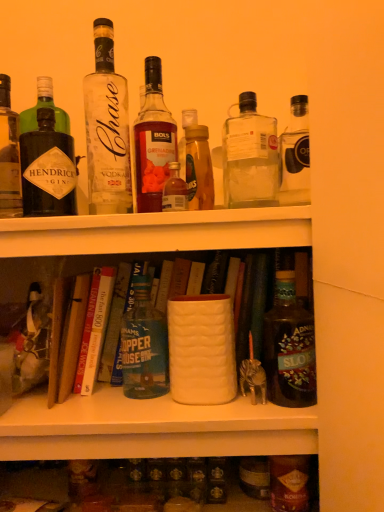
Measure the distance between point (87, 390) and camera.

31.61 inches.

The height and width of the screenshot is (512, 384). Describe the element at coordinates (94, 330) in the screenshot. I see `hardcover book at center, the 2th book positioned from the right` at that location.

This screenshot has width=384, height=512. What do you see at coordinates (199, 168) in the screenshot?
I see `translucent glass bottle at center, placed as the 5th bottle when sorted from left to right` at bounding box center [199, 168].

Locate an element on the screen. This screenshot has width=384, height=512. translucent glass bottle at center, placed as the 5th bottle when sorted from left to right is located at coordinates (199, 168).

In order to face matte white vase at center, should I rotate leftwards or rightwards?

It's best to rotate right around 1.513 degrees.

Measure the distance between hardcover book at center, the third book in the left-to-right sequence, and camera.

hardcover book at center, the third book in the left-to-right sequence, is 33.37 inches away from camera.

You are a GUI agent. You are given a task and a screenshot of the screen. Output one action in this format:
    pyautogui.click(x=<x>, y=<y>)
    Task: Click on the hardcover book at center, placed as the third book when sorted from right to left
    The width and height of the screenshot is (384, 512).
    Given the screenshot: What is the action you would take?
    click(x=72, y=336)

Locate an element on the screen. hardcover book at center, acting as the second book starting from the left is located at coordinates (94, 330).

Between hardcover book at center, positioned as the first book in right-to-left order, and matte black gin bottle at left, the first bottle in the left-to-right sequence, which one has smaller width?

With smaller width is matte black gin bottle at left, the first bottle in the left-to-right sequence.

Is hardcover book at center, the third book in the left-to-right sequence, facing towards matte black gin bottle at left, which appears as the 8th bottle when viewed from the right?

No, hardcover book at center, the third book in the left-to-right sequence, is not facing towards matte black gin bottle at left, which appears as the 8th bottle when viewed from the right.

Which object is positioned more to the left, hardcover book at center, the third book in the left-to-right sequence, or matte black gin bottle at left, the first bottle in the left-to-right sequence?

matte black gin bottle at left, the first bottle in the left-to-right sequence, is more to the left.

From a real-world perspective, which object stands above the other?

matte black gin bottle at left, which appears as the 8th bottle when viewed from the right, from a real-world perspective.

Does point (274, 362) come in front of point (158, 336)?

Yes, it is.

Between dark brown glass bottle at right, acting as the 1th bottle starting from the right, and green glass bottle at center, the third bottle positioned from the left, which one has more height?

With more height is green glass bottle at center, the third bottle positioned from the left.

Is dark brown glass bottle at right, acting as the 1th bottle starting from the right, to the left of green glass bottle at center, the third bottle positioned from the left, from the viewer's perspective?

Incorrect, dark brown glass bottle at right, acting as the 1th bottle starting from the right, is not on the left side of green glass bottle at center, the third bottle positioned from the left.

Consider the image. Does dark brown glass bottle at right, acting as the 1th bottle starting from the right, turn towards green glass bottle at center, the third bottle positioned from the left?

No, dark brown glass bottle at right, acting as the 1th bottle starting from the right, is not facing towards green glass bottle at center, the third bottle positioned from the left.

Does matte black gin bottle at left, which appears as the 8th bottle when viewed from the right, lie in front of translucent glass bottle at center, placed as the 5th bottle when sorted from left to right?

That is False.

From the image's perspective, does matte black gin bottle at left, the first bottle in the left-to-right sequence, appear lower than translucent glass bottle at center, placed as the 5th bottle when sorted from left to right?

→ Actually, matte black gin bottle at left, the first bottle in the left-to-right sequence, appears above translucent glass bottle at center, placed as the 5th bottle when sorted from left to right, in the image.

Is matte black gin bottle at left, the first bottle in the left-to-right sequence, with translucent glass bottle at center, placed as the 5th bottle when sorted from left to right?

No, matte black gin bottle at left, the first bottle in the left-to-right sequence, is not touching translucent glass bottle at center, placed as the 5th bottle when sorted from left to right.

Does matte black gin bottle at left, which appears as the 8th bottle when viewed from the right, have a larger size compared to translucent glass bottle at center, which appears as the fourth bottle when viewed from the right?

Yes.

From the image's perspective, between hardcover book at center, placed as the first book when sorted from left to right, and hardcover book at center, the third book in the left-to-right sequence, who is located below?

hardcover book at center, placed as the first book when sorted from left to right, appears lower in the image.

Is hardcover book at center, placed as the first book when sorted from left to right, inside the boundaries of hardcover book at center, positioned as the first book in right-to-left order, or outside?

The correct answer is: outside.

Considering the points (83, 297) and (115, 304), which point is in front, point (83, 297) or point (115, 304)?

Positioned in front is point (83, 297).

Is hardcover book at center, placed as the third book when sorted from right to left, next to hardcover book at center, positioned as the first book in right-to-left order?

Yes, hardcover book at center, placed as the third book when sorted from right to left, is with hardcover book at center, positioned as the first book in right-to-left order.

Who is bigger, matte black gin bottle at left, which appears as the 8th bottle when viewed from the right, or green glass bottle at center, which is the 6th bottle from right to left?

Bigger between the two is green glass bottle at center, which is the 6th bottle from right to left.

Is matte black gin bottle at left, which appears as the 8th bottle when viewed from the right, positioned far away from green glass bottle at center, which is the 6th bottle from right to left?

No, matte black gin bottle at left, which appears as the 8th bottle when viewed from the right, is in close proximity to green glass bottle at center, which is the 6th bottle from right to left.

Which of these two, matte black gin bottle at left, which appears as the 8th bottle when viewed from the right, or green glass bottle at center, which is the 6th bottle from right to left, stands shorter?

green glass bottle at center, which is the 6th bottle from right to left.

Is matte black gin bottle at left, the first bottle in the left-to-right sequence, wider or thinner than green glass bottle at center, which is the 6th bottle from right to left?

Considering their sizes, matte black gin bottle at left, the first bottle in the left-to-right sequence, looks slimmer than green glass bottle at center, which is the 6th bottle from right to left.

Considering the sizes of matte white vase at center and matte black gin bottle at left, which appears as the 8th bottle when viewed from the right, in the image, is matte white vase at center taller or shorter than matte black gin bottle at left, which appears as the 8th bottle when viewed from the right,?

In the image, matte white vase at center appears to be shorter than matte black gin bottle at left, which appears as the 8th bottle when viewed from the right.

Consider the image. How different are the orientations of matte white vase at center and matte black gin bottle at left, the first bottle in the left-to-right sequence, in degrees?

1.82 degrees.

Is matte white vase at center not inside matte black gin bottle at left, which appears as the 8th bottle when viewed from the right?

Yes.

From a real-world perspective, which is physically below, matte white vase at center or matte black gin bottle at left, the first bottle in the left-to-right sequence?

matte white vase at center is physically lower.

Between point (216, 399) and point (289, 295), which one is positioned behind?

The point (289, 295) is behind.

Locate an element on the screen. This screenshot has height=512, width=384. coffee cup that appears below the dark brown glass bottle at right, acting as the eighth bottle starting from the left (from a real-world perspective) is located at coordinates (201, 349).

Is matte white vase at center next to dark brown glass bottle at right, acting as the 1th bottle starting from the right?

No.

Which is more to the right, matte white vase at center or dark brown glass bottle at right, acting as the 1th bottle starting from the right?

From the viewer's perspective, dark brown glass bottle at right, acting as the 1th bottle starting from the right, appears more on the right side.

In order to click on the 3rd bottle in front of the hardcover book at center, positioned as the first book in right-to-left order in this screenshot , I will do [x=9, y=155].

The height and width of the screenshot is (512, 384). I want to click on bottle that is the 6th object located behind the dark brown glass bottle at right, acting as the eighth bottle starting from the left, so click(x=144, y=346).

Which object lies nearer to the anchor point green glass bottle at center, which is the 6th bottle from right to left, matte white vase at center or translucent glass bottle at center, the 4th bottle in the left-to-right sequence?

matte white vase at center lies closer to green glass bottle at center, which is the 6th bottle from right to left, than the other object.

Looking at the image, which one is located further to matte brown bottle at lower right, the 7th bottle positioned from the left, matte white vase at center or hardcover book at center, positioned as the first book in right-to-left order?

The object further to matte brown bottle at lower right, the 7th bottle positioned from the left, is hardcover book at center, positioned as the first book in right-to-left order.

Consider the image. Considering their positions, is hardcover book at center, placed as the third book when sorted from right to left, positioned further to matte brown bottle at lower right, which is the 2th bottle in right-to-left order, than hardcover book at center, acting as the second book starting from the left?

Among the two, hardcover book at center, placed as the third book when sorted from right to left, is located further to matte brown bottle at lower right, which is the 2th bottle in right-to-left order.

Looking at the image, which one is located closer to translucent glass bottle at center, which is counted as the fifth bottle, starting from the right, hardcover book at center, the 2th book positioned from the right, or matte black gin bottle at left, which appears as the 8th bottle when viewed from the right?

Among the two, matte black gin bottle at left, which appears as the 8th bottle when viewed from the right, is located nearer to translucent glass bottle at center, which is counted as the fifth bottle, starting from the right.

When comparing their distances from hardcover book at center, positioned as the first book in right-to-left order, does clear glass bottle at upper center, marked as the 3th bottle in a right-to-left arrangement, or hardcover book at center, acting as the second book starting from the left, seem further?

clear glass bottle at upper center, marked as the 3th bottle in a right-to-left arrangement, lies further to hardcover book at center, positioned as the first book in right-to-left order, than the other object.

Which object lies nearer to the anchor point hardcover book at center, placed as the first book when sorted from left to right, clear glass bottle at upper center, the 2th bottle when ordered from left to right, or translucent glass bottle at center, which appears as the fourth bottle when viewed from the right?

The object closer to hardcover book at center, placed as the first book when sorted from left to right, is clear glass bottle at upper center, the 2th bottle when ordered from left to right.

Consider the image. Looking at the image, which one is located closer to matte black gin bottle at left, which appears as the 8th bottle when viewed from the right, translucent glass bottle at center, the 4th bottle in the left-to-right sequence, or hardcover book at center, the 2th book positioned from the right?

hardcover book at center, the 2th book positioned from the right, is closer to matte black gin bottle at left, which appears as the 8th bottle when viewed from the right.

Looking at the image, which one is located further to translucent glass bottle at center, the 4th bottle in the left-to-right sequence, translucent glass bottle at center, placed as the 5th bottle when sorted from left to right, or matte brown bottle at lower right, the 7th bottle positioned from the left?

The object further to translucent glass bottle at center, the 4th bottle in the left-to-right sequence, is matte brown bottle at lower right, the 7th bottle positioned from the left.

Identify the location of coffee cup that lies between green glass bottle at center, which is the 6th bottle from right to left, and matte brown bottle at lower right, the 7th bottle positioned from the left, from top to bottom. Image resolution: width=384 pixels, height=512 pixels. (201, 349).

At what (x,y) coordinates should I click in order to perform the action: click on book between hardcover book at center, acting as the second book starting from the left, and matte brown bottle at lower right, the 7th bottle positioned from the left. Please return your answer as a coordinate pair (x, y). This screenshot has height=512, width=384. Looking at the image, I should click on (114, 322).

This screenshot has width=384, height=512. In order to click on coffee cup between dark brown glass bottle at right, acting as the eighth bottle starting from the left, and matte brown bottle at lower right, which is the 2th bottle in right-to-left order, in the vertical direction in this screenshot , I will do `click(201, 349)`.

Find the location of a particular element. coffee cup located between hardcover book at center, placed as the first book when sorted from left to right, and dark brown glass bottle at right, acting as the eighth bottle starting from the left, in the left-right direction is located at coordinates (201, 349).